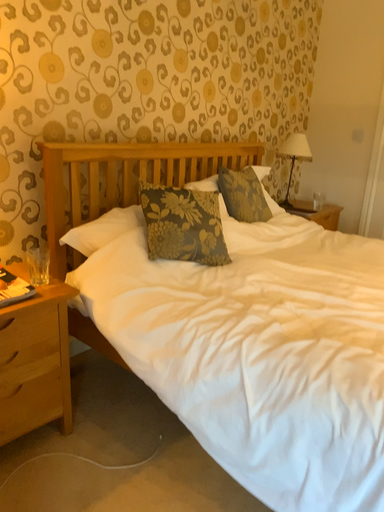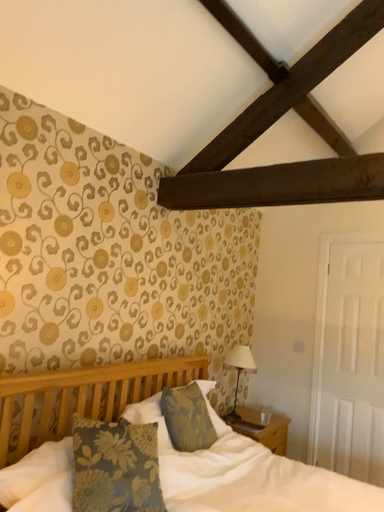
Question: How did the camera likely rotate when shooting the video?

Choices:
 (A) rotated upward
 (B) rotated downward

Answer: (A)